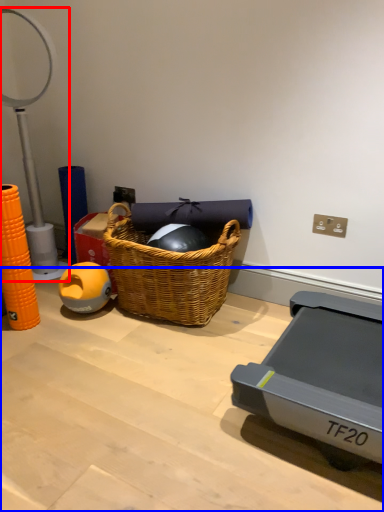
Question: Which object appears farthest to the camera in this image, table lamp (highlighted by a red box) or table (highlighted by a blue box)?

Choices:
 (A) table lamp
 (B) table

Answer: (A)